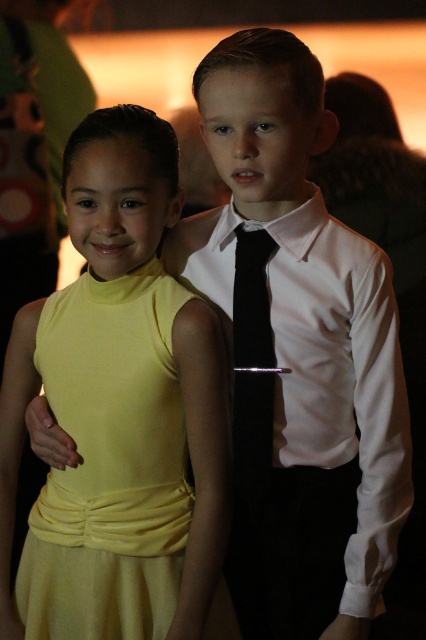
Based on the photo, you are a photographer setting up for a group photo. You notice the matte yellow dress at center and the black silk tie at center. Which one is closer to the camera?

The matte yellow dress at center is in front of the black silk tie at center, so it is closer to the camera.

Consider the image. You are a photographer setting up for a group photo. You need to ensure that the two children in the image are positioned at least 10 inches apart for the composition. Currently, the matte yellow dress at center and the white smooth dress shirt at center are in the frame. Based on their current positions, will they meet the required distance?

The distance between the matte yellow dress at center and the white smooth dress shirt at center is 8.42 inches, which is less than the required 10 inches. Therefore, they do not meet the required distance and need to move further apart.

You are standing in front of the two children in the image. There is a point at coordinates point (328, 305) that you need to reach. Can you estimate if you can reach it without moving your position?

The point (328, 305) is 1.27 meters away from the viewer. Assuming an average adult arm length of about 0.7 meters, you would not be able to reach it without moving your position.